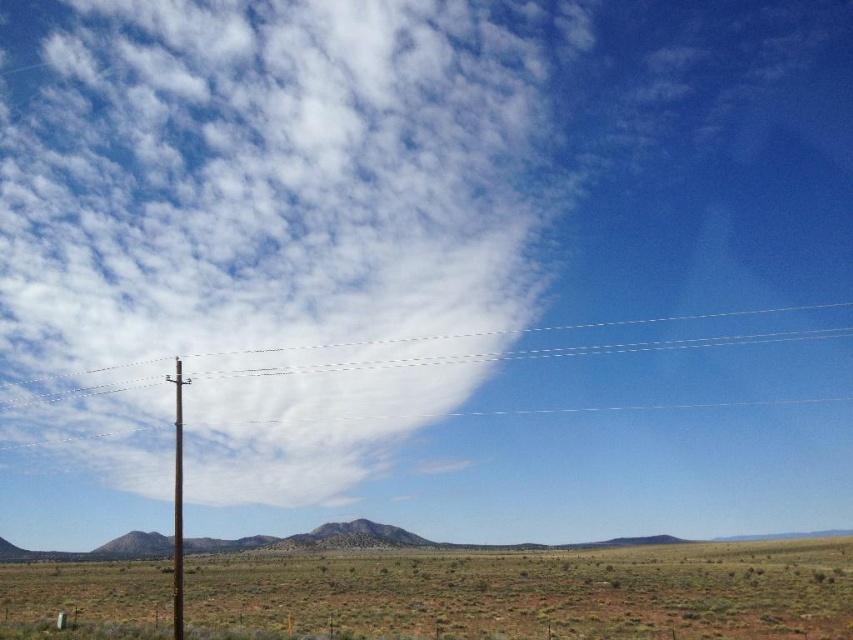
Question: Which point appears closest to the camera in this image?

Choices:
 (A) (445, 625)
 (B) (175, 538)
 (C) (456, 316)

Answer: (A)

Question: Which of these objects is positioned farthest from the white fluffy cloud at upper center?

Choices:
 (A) smooth brown pole at center
 (B) green matte grassland at lower center

Answer: (B)

Question: Can you confirm if white fluffy cloud at upper center is positioned above smooth brown pole at center?

Choices:
 (A) no
 (B) yes

Answer: (B)

Question: Is white fluffy cloud at upper center thinner than smooth brown pole at center?

Choices:
 (A) no
 (B) yes

Answer: (A)

Question: Which object appears closest to the camera in this image?

Choices:
 (A) smooth brown pole at center
 (B) green matte grassland at lower center
 (C) white fluffy cloud at upper center

Answer: (A)

Question: Does white fluffy cloud at upper center lie behind smooth brown pole at center?

Choices:
 (A) no
 (B) yes

Answer: (B)